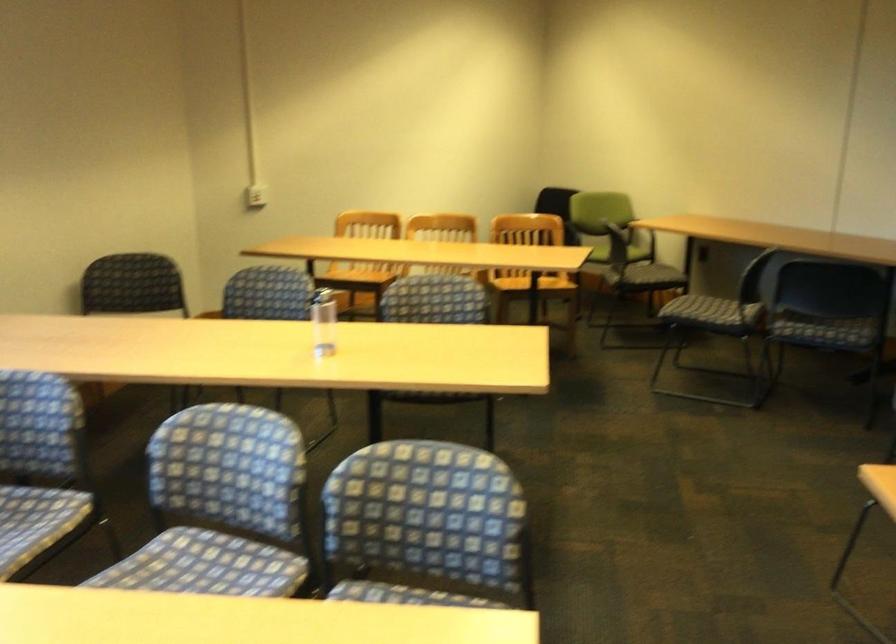
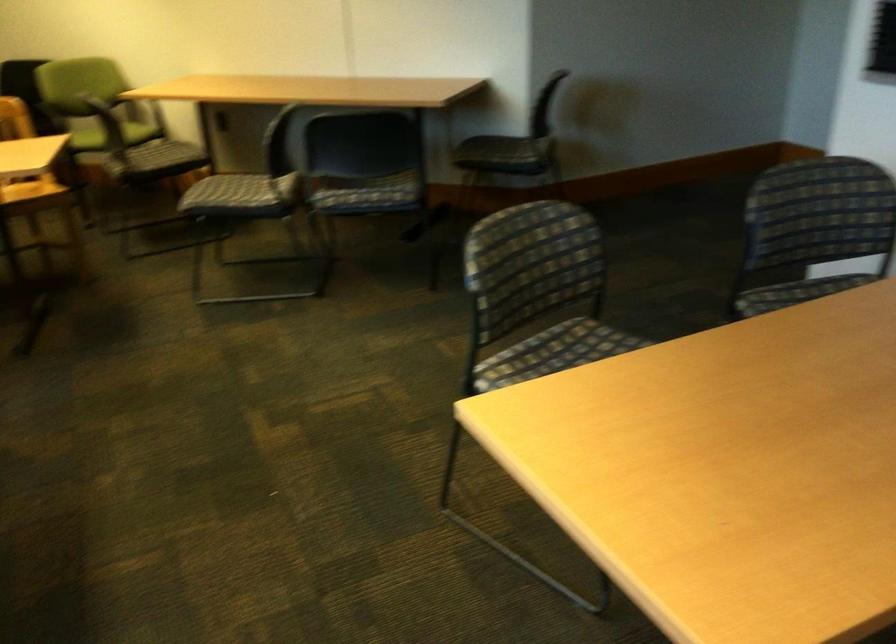
Question: The camera is either moving clockwise (left) or counter-clockwise (right) around the object. The first image is from the beginning of the video and the second image is from the end. Is the camera moving left or right when shooting the video?

Choices:
 (A) Left
 (B) Right

Answer: (A)